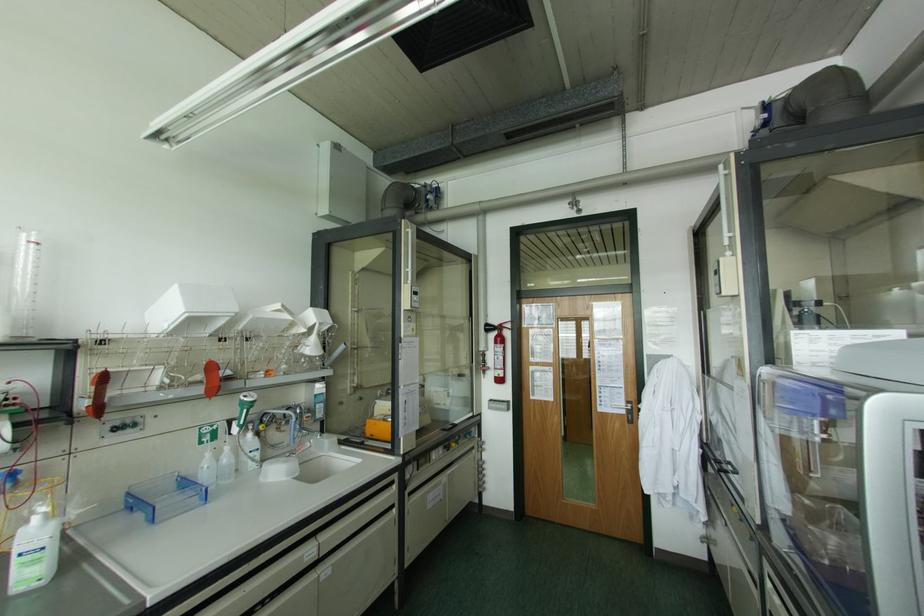
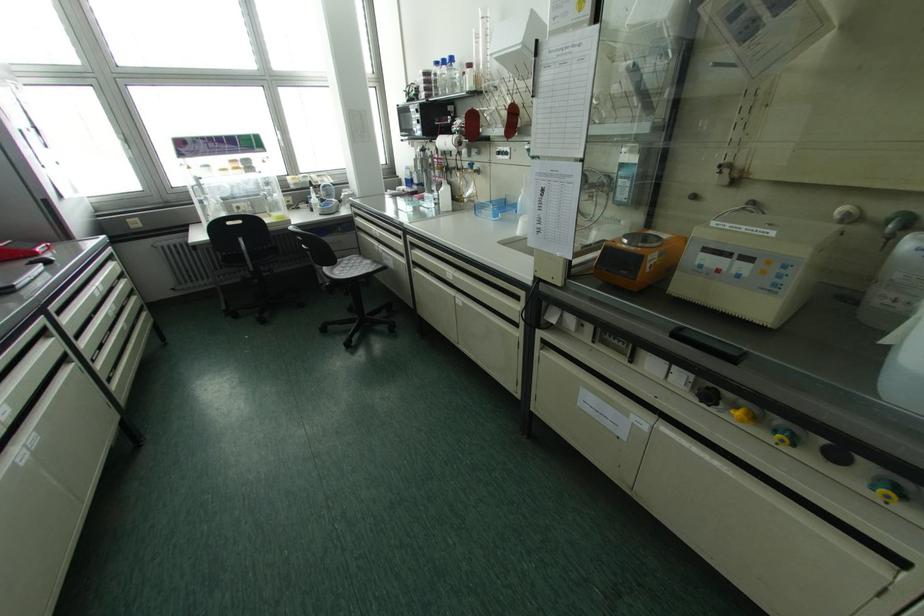
The point at (115, 428) is marked in the first image. Where is the corresponding point in the second image?

(497, 153)